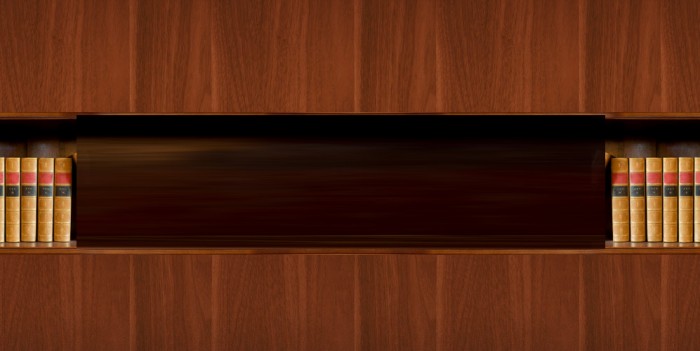
Where is `books on left side of shelf`? This screenshot has height=351, width=700. books on left side of shelf is located at coordinates (59, 182), (43, 206), (26, 224), (17, 233), (0, 201).